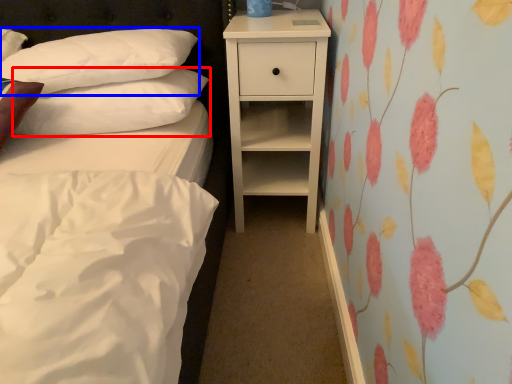
Question: Which object appears closest to the camera in this image, pillow (highlighted by a red box) or pillow (highlighted by a blue box)?

Choices:
 (A) pillow
 (B) pillow

Answer: (B)